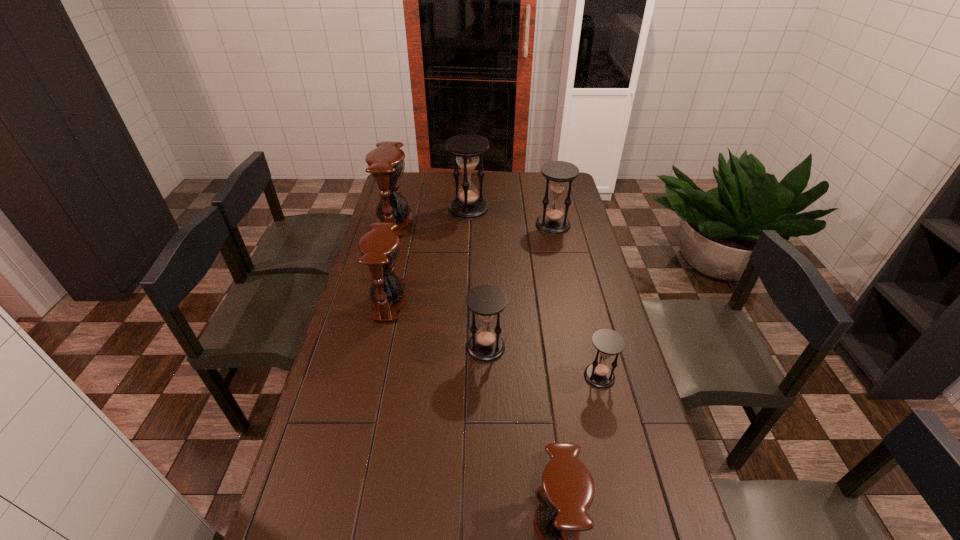
The image size is (960, 540). In order to click on object that is the fourth closest to the fourth farthest hourglass in this screenshot , I will do `click(558, 173)`.

You are a GUI agent. You are given a task and a screenshot of the screen. Output one action in this format:
    pyautogui.click(x=<x>, y=<y>)
    Task: Click on the sixth closest hourglass relative to the second biggest black hourglass
    Image resolution: width=960 pixels, height=540 pixels.
    Given the screenshot: What is the action you would take?
    pyautogui.click(x=567, y=490)

Select which hourglass is the closest to the second nearest object. Please provide its 2D coordinates. Your answer should be formatted as a tuple, i.e. [(x, y)], where the tuple contains the x and y coordinates of a point satisfying the conditions above.

[(486, 301)]

You are a GUI agent. You are given a task and a screenshot of the screen. Output one action in this format:
    pyautogui.click(x=<x>, y=<y>)
    Task: Click on the black hourglass that is the closest to the smallest black hourglass
    
    Given the screenshot: What is the action you would take?
    pyautogui.click(x=486, y=301)

What are the coordinates of `black hourglass identified as the second closest to the shortest hourglass` in the screenshot? It's located at (558, 173).

This screenshot has height=540, width=960. Identify the location of brown hourglass that stands as the closest to the rightmost brown hourglass. (379, 248).

Where is `brown hourglass that stands as the second closest to the biggest brown hourglass`? The height and width of the screenshot is (540, 960). brown hourglass that stands as the second closest to the biggest brown hourglass is located at coordinates (x=567, y=490).